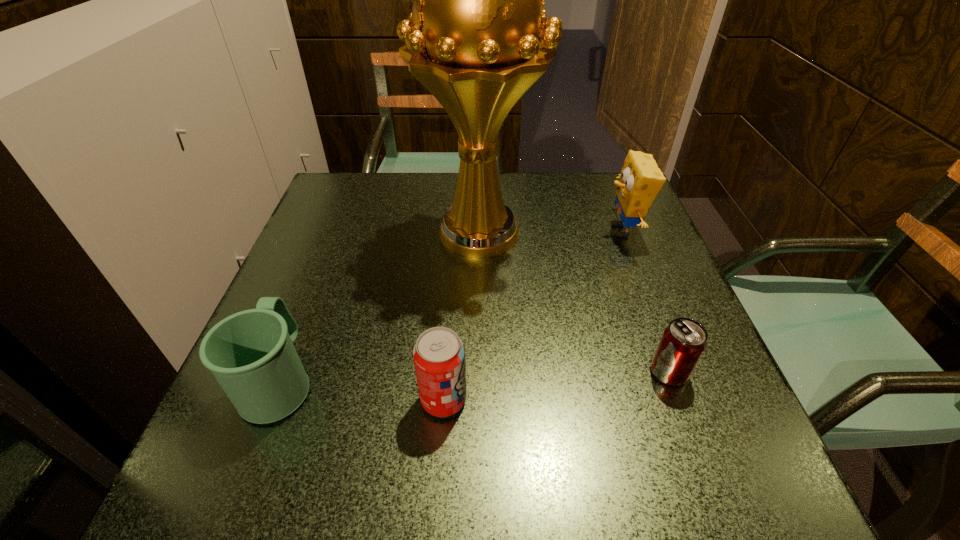
Where is `object positioned at the far right corner`? The image size is (960, 540). object positioned at the far right corner is located at coordinates (640, 181).

This screenshot has width=960, height=540. I want to click on vacant point at the far edge, so click(397, 202).

In the image, there is a desktop. Where is `vacant area at the near edge`? This screenshot has height=540, width=960. vacant area at the near edge is located at coordinates (556, 498).

At what (x,y) coordinates should I click in order to perform the action: click on free space at the left edge of the desktop. Please return your answer as a coordinate pair (x, y). Looking at the image, I should click on (300, 257).

You are a GUI agent. You are given a task and a screenshot of the screen. Output one action in this format:
    pyautogui.click(x=<x>, y=<y>)
    Task: Click on the vacant space at the right edge
    The width and height of the screenshot is (960, 540).
    Given the screenshot: What is the action you would take?
    pyautogui.click(x=611, y=299)

In the image, there is a desktop. Identify the location of vacant space at the far left corner. (362, 181).

Where is `vacant space at the far right corner of the desktop`? vacant space at the far right corner of the desktop is located at coordinates (611, 194).

Find the location of a particular element. This screenshot has height=540, width=960. free spot between the sponge and the taller pop soda is located at coordinates (533, 315).

Find the location of a particular element. This screenshot has height=540, width=960. vacant area between the leftmost object and the fourth shortest object is located at coordinates (451, 305).

Identify the location of unoccupied position between the fourth shortest object and the right pop soda. The height and width of the screenshot is (540, 960). (645, 301).